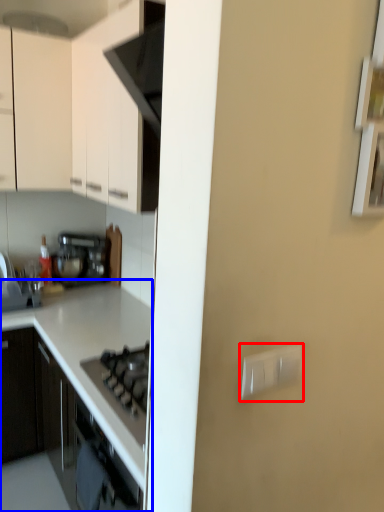
Question: Which object appears closest to the camera in this image, electric outlet (highlighted by a red box) or countertop (highlighted by a blue box)?

Choices:
 (A) electric outlet
 (B) countertop

Answer: (A)